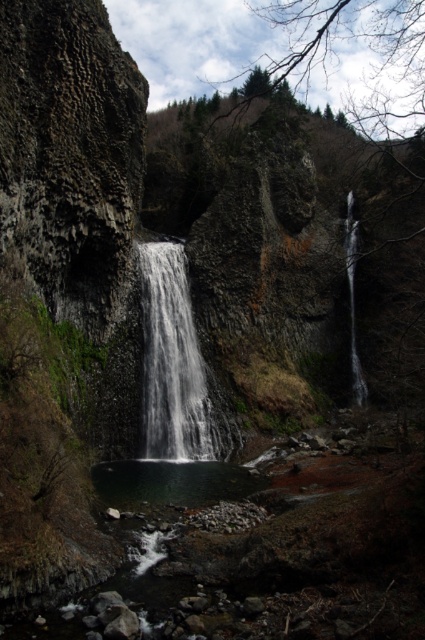
You are a hiker standing at the base of the white textured waterfall at center and want to reach the clear water at center. Which direction should you move to get there?

The white textured waterfall at center is to the left of clear water at center, so you should move to the right to reach the clear water at center.